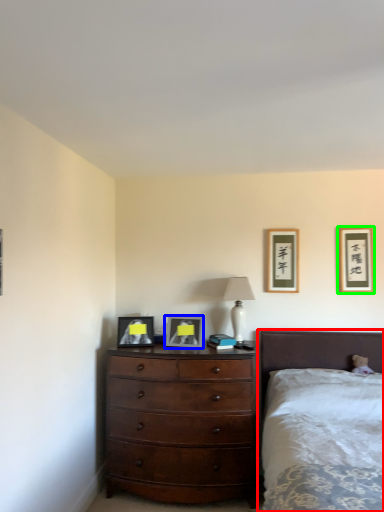
Question: Estimate the real-world distances between objects in this image. Which object is farther from bed (highlighted by a red box), picture frame (highlighted by a blue box) or picture frame (highlighted by a green box)?

Choices:
 (A) picture frame
 (B) picture frame

Answer: (A)